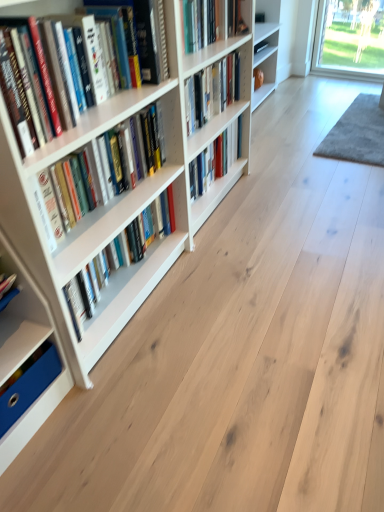
Locate an element on the screen. free spot to the right of white matte bookshelf at left is located at coordinates (91, 418).